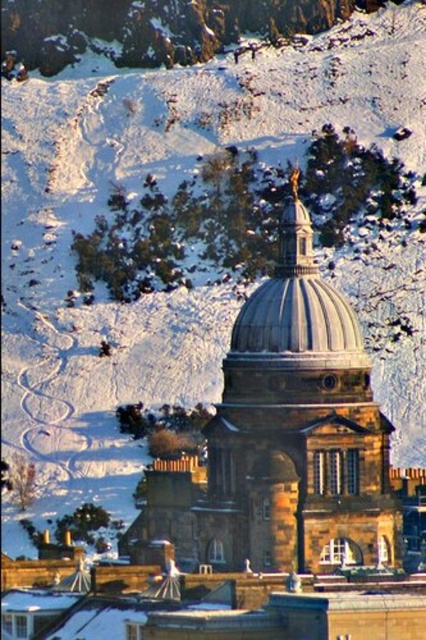
Is smooth stone dome at center to the left of shiny silver dome at center from the viewer's perspective?

Yes, smooth stone dome at center is to the left of shiny silver dome at center.

Is point (241, 458) positioned in front of point (302, 321)?

No.

Who is more forward, (x=290, y=509) or (x=279, y=339)?

Point (x=290, y=509)

In order to click on smooth stone dome at center in this screenshot , I will do `click(284, 440)`.